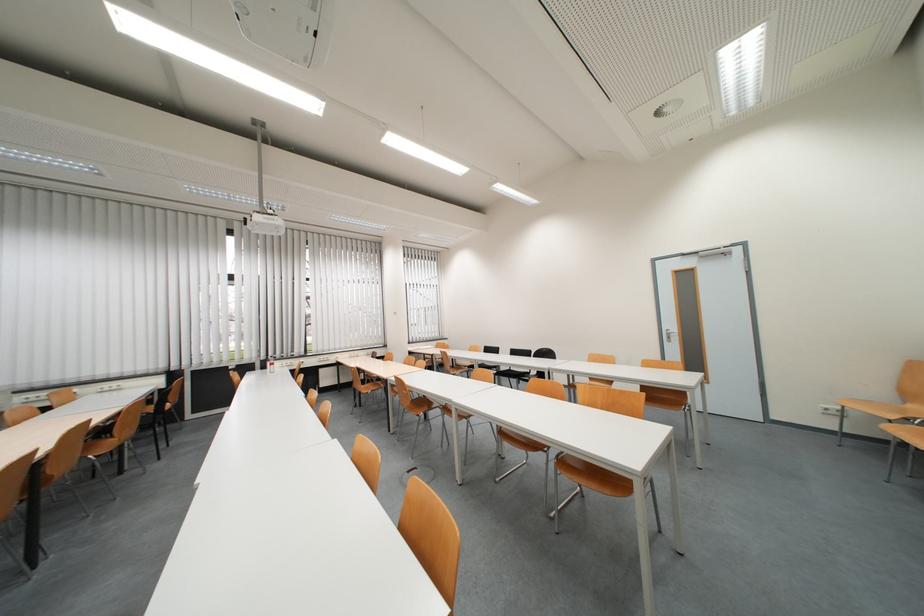
What are the coordinates of `metal door handle` in the screenshot? It's located at pos(667,334).